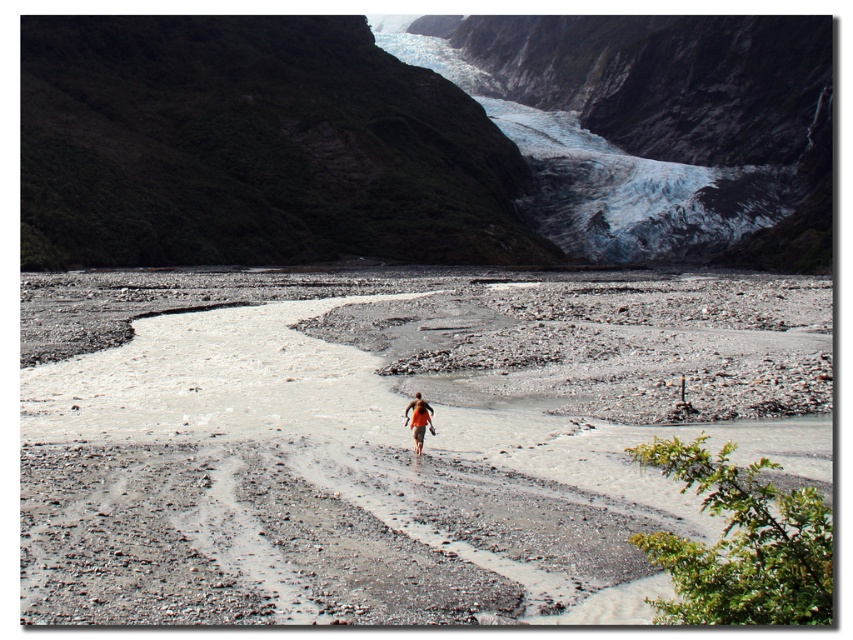
Question: Is gray gravel riverbed at center positioned in front of orange fabric person at center?

Choices:
 (A) no
 (B) yes

Answer: (B)

Question: Is green mossy rock at upper left further to the viewer compared to blue ice glacier at upper center?

Choices:
 (A) no
 (B) yes

Answer: (A)

Question: Estimate the real-world distances between objects in this image. Which object is farther from the blue ice glacier at upper center?

Choices:
 (A) gray gravel riverbed at center
 (B) orange fabric person at center

Answer: (B)

Question: Which object is closer to the camera taking this photo?

Choices:
 (A) blue ice glacier at upper center
 (B) green mossy rock at upper left
 (C) gray gravel riverbed at center
 (D) orange fabric person at center

Answer: (C)

Question: Which point is closer to the camera taking this photo?

Choices:
 (A) (413, 422)
 (B) (42, 509)

Answer: (B)

Question: Is green mossy rock at upper left bigger than blue ice glacier at upper center?

Choices:
 (A) no
 (B) yes

Answer: (A)